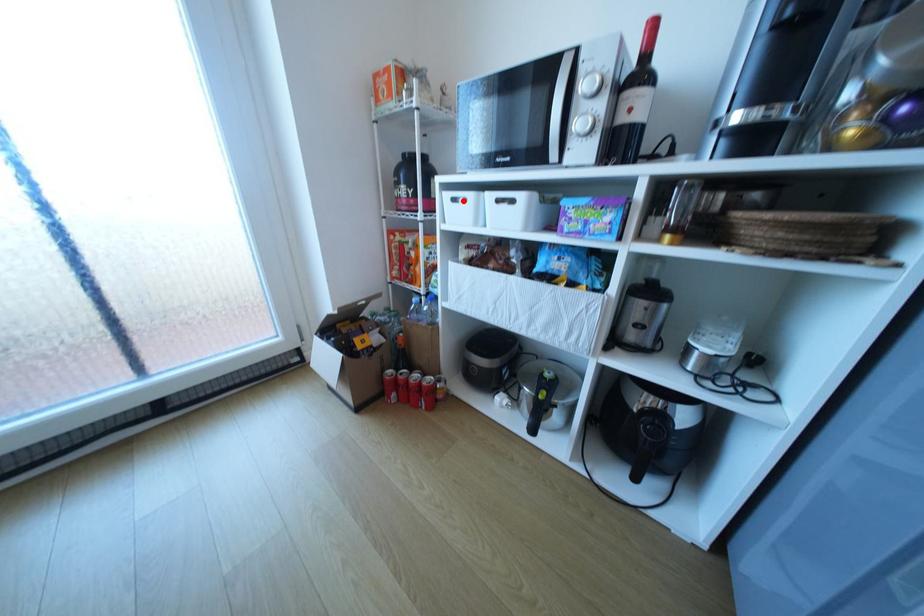
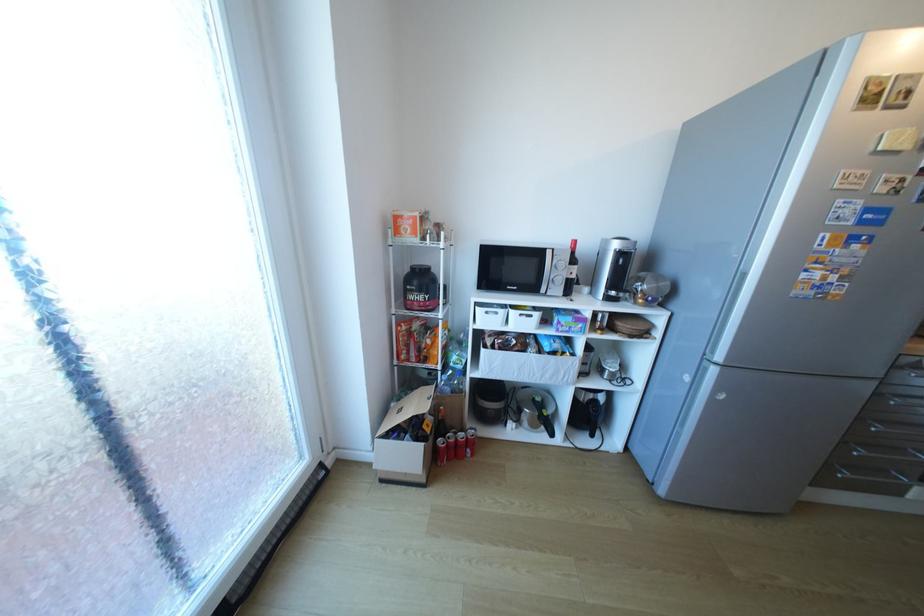
In the second image, find the point that corresponds to the highlighted location in the first image.

(495, 313)